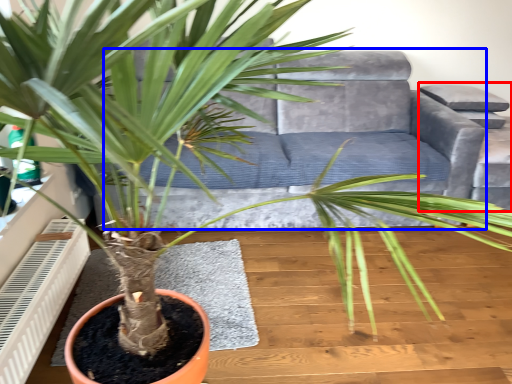
Question: Among these objects, which one is farthest to the camera, armchair (highlighted by a red box) or couch (highlighted by a blue box)?

Choices:
 (A) armchair
 (B) couch

Answer: (A)